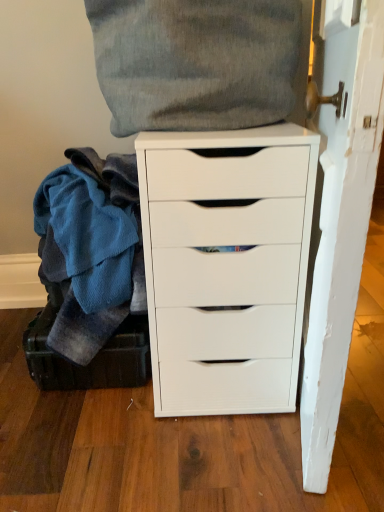
Question: Is soft gray fabric pillow at upper center, the first clothing when ordered from top to bottom, completely or partially outside of white matte chest of drawers at center?

Choices:
 (A) yes
 (B) no

Answer: (A)

Question: Does soft gray fabric pillow at upper center, the first clothing when ordered from top to bottom, have a lesser height compared to white matte chest of drawers at center?

Choices:
 (A) no
 (B) yes

Answer: (B)

Question: Is soft gray fabric pillow at upper center, the first clothing when ordered from top to bottom, not close to white matte chest of drawers at center?

Choices:
 (A) no
 (B) yes

Answer: (A)

Question: From a real-world perspective, does soft gray fabric pillow at upper center, the first clothing when ordered from top to bottom, stand above white matte chest of drawers at center?

Choices:
 (A) no
 (B) yes

Answer: (B)

Question: Does soft gray fabric pillow at upper center, the first clothing when ordered from top to bottom, have a larger size compared to white matte chest of drawers at center?

Choices:
 (A) no
 (B) yes

Answer: (A)

Question: Considering the relative sizes of soft gray fabric pillow at upper center, the 2th clothing positioned from the bottom, and white matte chest of drawers at center in the image provided, is soft gray fabric pillow at upper center, the 2th clothing positioned from the bottom, thinner than white matte chest of drawers at center?

Choices:
 (A) no
 (B) yes

Answer: (B)

Question: Does soft gray fabric pillow at upper center, the 2th clothing positioned from the bottom, have a lesser height compared to dark green leather suitcase at lower left?

Choices:
 (A) yes
 (B) no

Answer: (B)

Question: From the image's perspective, is soft gray fabric pillow at upper center, the first clothing when ordered from top to bottom, beneath dark green leather suitcase at lower left?

Choices:
 (A) yes
 (B) no

Answer: (B)

Question: Is dark green leather suitcase at lower left located within soft gray fabric pillow at upper center, the first clothing when ordered from top to bottom?

Choices:
 (A) yes
 (B) no

Answer: (B)

Question: Is soft gray fabric pillow at upper center, the 2th clothing positioned from the bottom, at the left side of dark green leather suitcase at lower left?

Choices:
 (A) yes
 (B) no

Answer: (B)

Question: Does soft gray fabric pillow at upper center, the first clothing when ordered from top to bottom, have a smaller size compared to dark green leather suitcase at lower left?

Choices:
 (A) yes
 (B) no

Answer: (B)

Question: Is soft gray fabric pillow at upper center, the first clothing when ordered from top to bottom, in front of dark green leather suitcase at lower left?

Choices:
 (A) no
 (B) yes

Answer: (B)

Question: Is blue fleece blanket at left, the second clothing in the top-to-bottom sequence, facing away from dark green leather suitcase at lower left?

Choices:
 (A) yes
 (B) no

Answer: (B)